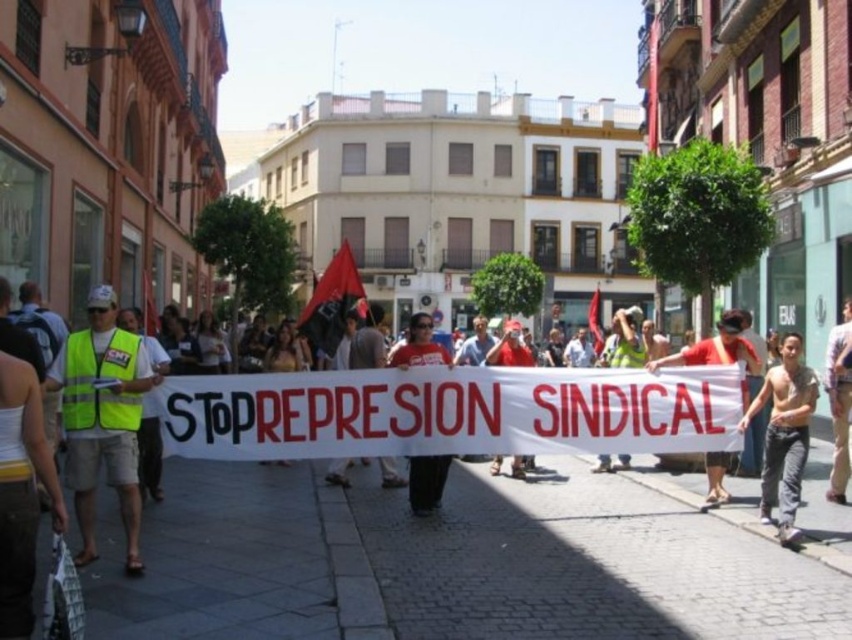
Question: Is shiny black shirt at center to the right of high-visibility yellow safety vest at left from the viewer's perspective?

Choices:
 (A) yes
 (B) no

Answer: (A)

Question: Which object is the farthest from the yellow reflective vest at left?

Choices:
 (A) high-visibility yellow safety vest at left
 (B) shiny black shirt at center

Answer: (B)

Question: Which point is farther to the camera?

Choices:
 (A) (140, 340)
 (B) (804, 422)

Answer: (B)

Question: Is yellow reflective vest at left to the left of shiny black shirt at center from the viewer's perspective?

Choices:
 (A) no
 (B) yes

Answer: (B)

Question: Does yellow reflective vest at left come behind high-visibility yellow safety vest at left?

Choices:
 (A) yes
 (B) no

Answer: (B)

Question: Which point is closer to the camera?

Choices:
 (A) [x=793, y=339]
 (B) [x=96, y=452]
 (C) [x=83, y=364]

Answer: (B)